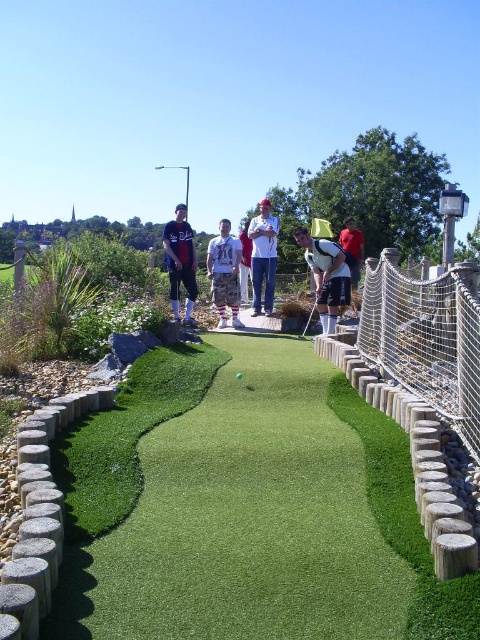
You are playing miniature golf and see the white matte golf club at center and the green rubber golf ball at center. Which object is closer to you?

The white matte golf club at center is closer to you because the green rubber golf ball at center is behind it.

In the scene shown: You are a photographer positioned behind the golfer. You want to capture both the camo pants at center and the red shirt at center in your shot. Which one will appear closer to the camera in the photo?

The camo pants at center will appear closer to the camera because it is in front of the red shirt at center.

You are playing miniature golf and want to hit the ball from point A to point B. The coordinates of point A are point A at (x=308, y=232) and point B are point B at (x=239, y=376). Considering the perspective of the golfer, which point is closer to you?

Point A at (x=308, y=232) is closer to you because it is further to the camera than point B at (x=239, y=376).